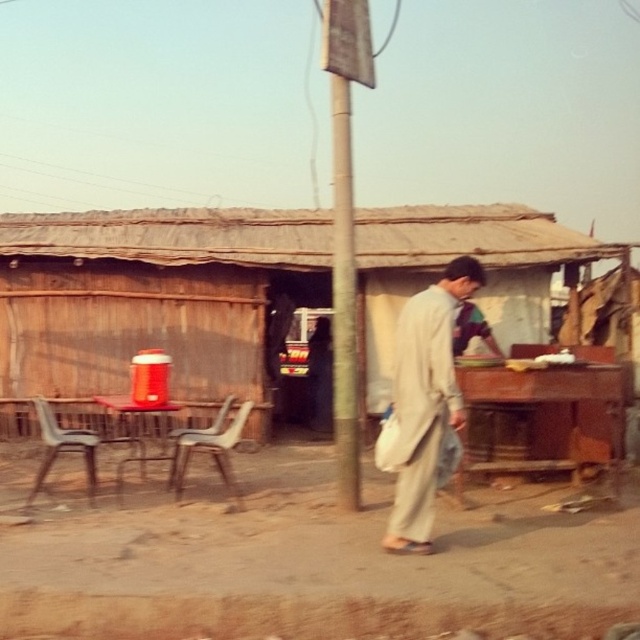
Based on the photo, you are standing at the point labeled point (33, 397) and want to walk towards the stall. Is the point labeled point (506, 308) in front of or behind you in your path?

The point labeled point (506, 308) is behind point (33, 397), so it would be behind you in your path towards the stall.

You are a photographer trying to capture the man in the light beige fabric robe at center and the plastic chair at center in the same frame. Based on their sizes in the image, which object would appear smaller in the photo?

The light beige fabric robe at center appears smaller in the photo because it has a lesser width compared to the plastic chair at center.